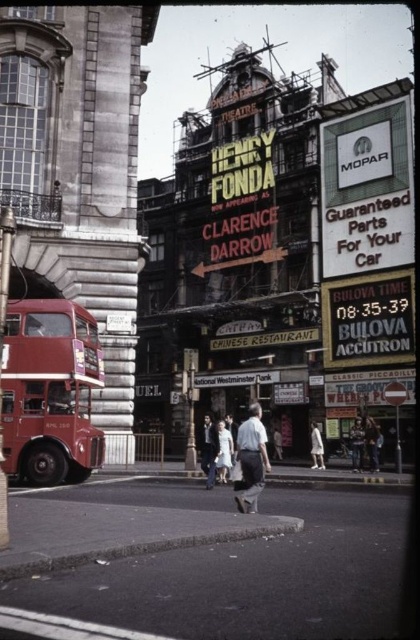
You are standing in the middle of the street looking at the construction site. There are two points marked on the building facade. Which point, point 1 at coordinates (256,422) or point 2 at (322,449), is closer to you?

Point 1 at coordinates (256,422) is closer to you than point 2 at (322,449).

You are a photographer standing in the middle of the bustling urban street scene. You notice a person wearing a light blue shirt at center and dark blue jeans at center. From your vantage point, which piece of clothing is positioned to the left?

The light blue shirt at center is positioned to the left of the dark blue jeans at center.